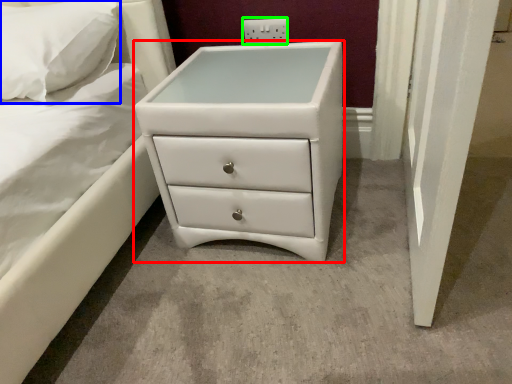
Question: Which object is positioned farthest from chest of drawers (highlighted by a red box)? Select from pillow (highlighted by a blue box) and electric outlet (highlighted by a green box).

Choices:
 (A) pillow
 (B) electric outlet

Answer: (B)